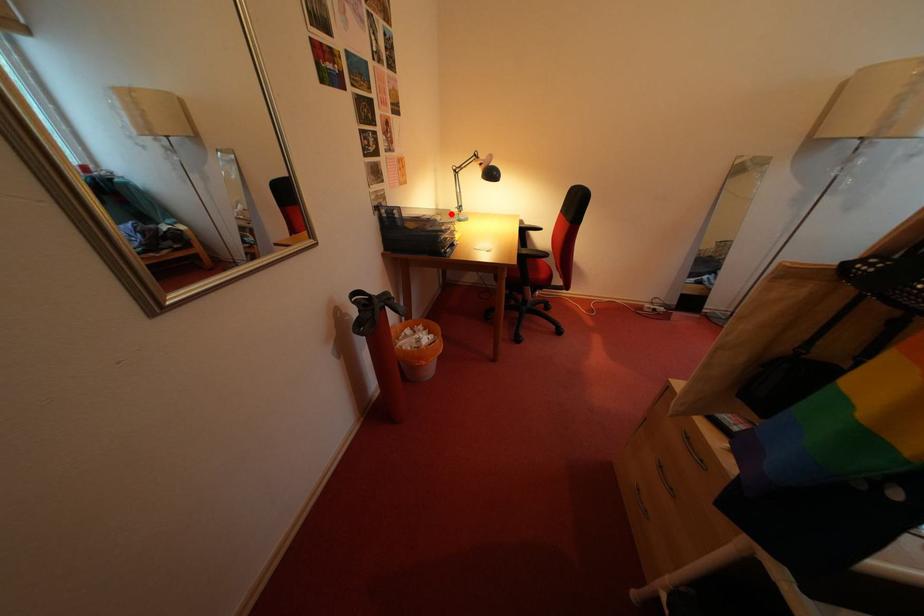
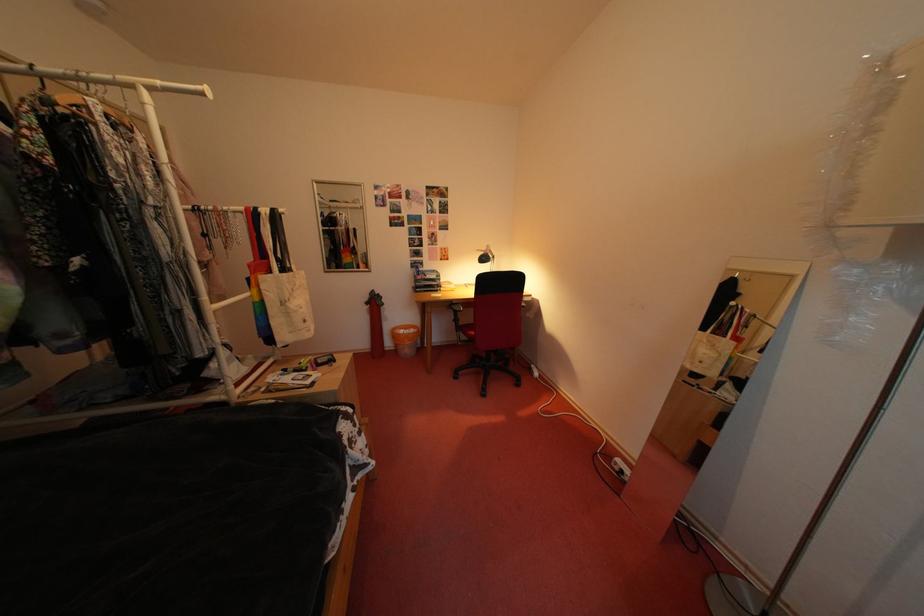
Question: I am providing you with two images of the same scene from different viewpoints. A red point is marked on the first image. At the location where the point appears in image 1, is it still visible in image 2?

Choices:
 (A) Yes
 (B) No

Answer: (B)